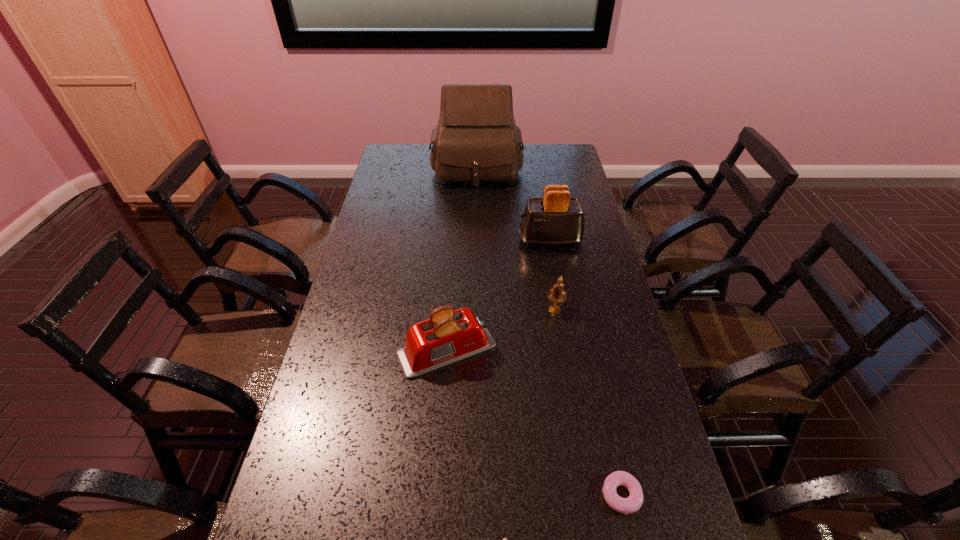
This screenshot has width=960, height=540. In the image, there is a desktop. Find the location of `free region at the right edge`. free region at the right edge is located at coordinates (576, 275).

The height and width of the screenshot is (540, 960). In the image, there is a desktop. What are the coordinates of `free space at the far left corner` in the screenshot? It's located at (414, 168).

This screenshot has width=960, height=540. What are the coordinates of `vacant area at the far right corner of the desktop` in the screenshot? It's located at (543, 167).

At what (x,y) coordinates should I click in order to perform the action: click on vacant area that lies between the nearer toaster and the right toaster. Please return your answer as a coordinate pair (x, y). This screenshot has width=960, height=540. Looking at the image, I should click on (x=498, y=295).

Identify the location of vacant space that is in between the doughnut and the farther toaster. (586, 367).

Identify the location of free space between the fifth farthest object and the nearer toaster. (534, 422).

The image size is (960, 540). Identify the location of free space between the shorter toaster and the second nearest object. (534, 422).

Locate an element on the screen. empty location between the farther toaster and the third farthest object is located at coordinates (552, 275).

This screenshot has height=540, width=960. Identify the location of vacant point located between the farthest object and the shortest object. (549, 331).

Locate an element on the screen. This screenshot has height=540, width=960. free space between the nearer toaster and the third farthest object is located at coordinates (501, 329).